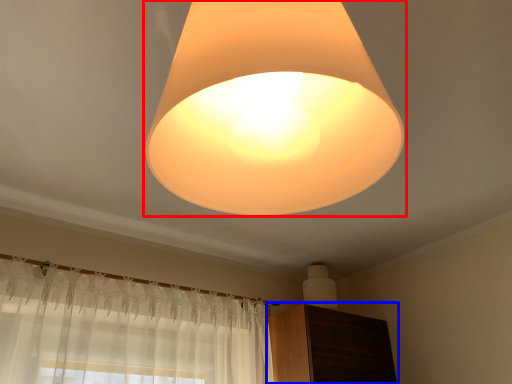
Question: Which object appears closest to the camera in this image, lamp (highlighted by a red box) or dresser (highlighted by a blue box)?

Choices:
 (A) lamp
 (B) dresser

Answer: (A)